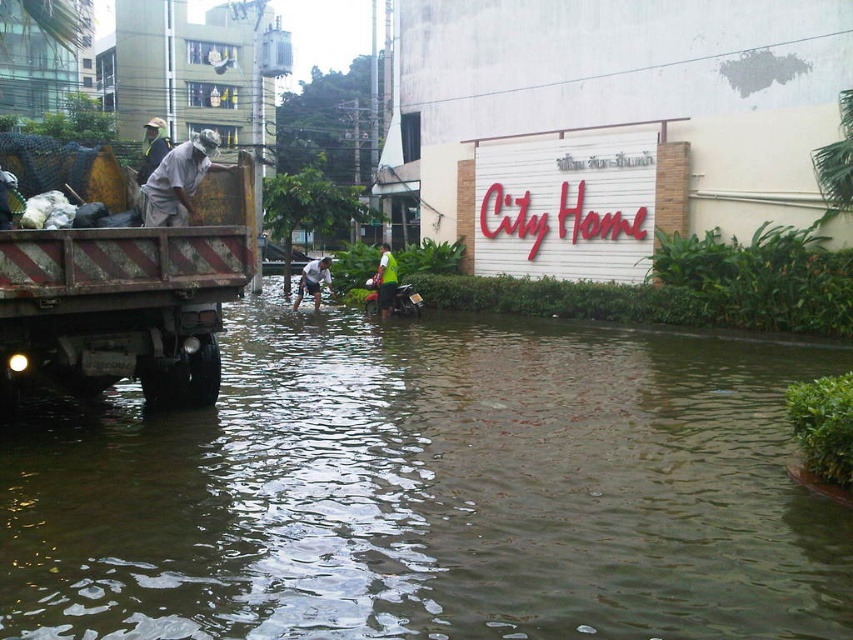
You are a pedestrian trying to cross the flooded street. You see the rusty metal truck at left and the green reflective vest at center. Which object is closer to the left side of the street?

The rusty metal truck at left is positioned on the left side of green reflective vest at center, so it is closer to the left side of the street.

You are standing in the flooded area and want to reach a safe zone. There are two points marked in the image. Which point, point 1 at coordinates (642,508) or point 2 at coordinates (381,314), is closer to you and would be easier to reach?

Point 1 at coordinates (642,508) is closer to the viewer than point 2 at coordinates (381,314), so it would be easier to reach.

You are a pedestrian trying to navigate through the flooded area. You see the brown murky water at lower center and the green reflective vest at center. Which object is closer to the ground?

The brown murky water at lower center has a lesser height compared to the green reflective vest at center, so the brown murky water at lower center is closer to the ground.